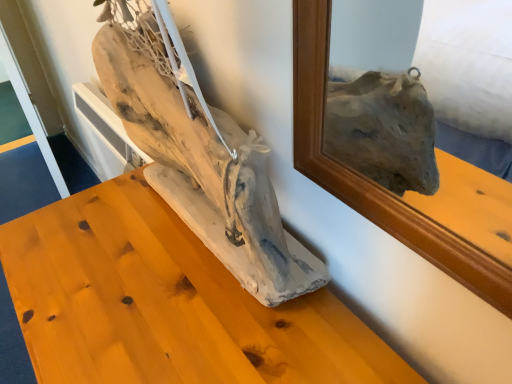
Question: Which is correct: natural wood driftwood at center is inside driftwood sculpture at center, or outside of it?

Choices:
 (A) inside
 (B) outside

Answer: (B)

Question: Considering the positions of point (243, 140) and point (307, 352), is point (243, 140) closer or farther from the camera than point (307, 352)?

Choices:
 (A) closer
 (B) farther

Answer: (A)

Question: In terms of width, does natural wood driftwood at center look wider or thinner when compared to driftwood sculpture at center?

Choices:
 (A) wide
 (B) thin

Answer: (B)

Question: Is driftwood sculpture at center inside or outside of natural wood driftwood at center?

Choices:
 (A) outside
 (B) inside

Answer: (A)

Question: Looking at the image, does driftwood sculpture at center seem bigger or smaller compared to natural wood driftwood at center?

Choices:
 (A) big
 (B) small

Answer: (A)

Question: Considering the positions of driftwood sculpture at center and natural wood driftwood at center in the image, is driftwood sculpture at center taller or shorter than natural wood driftwood at center?

Choices:
 (A) tall
 (B) short

Answer: (A)

Question: From a real-world perspective, is driftwood sculpture at center positioned above or below natural wood driftwood at center?

Choices:
 (A) below
 (B) above

Answer: (A)